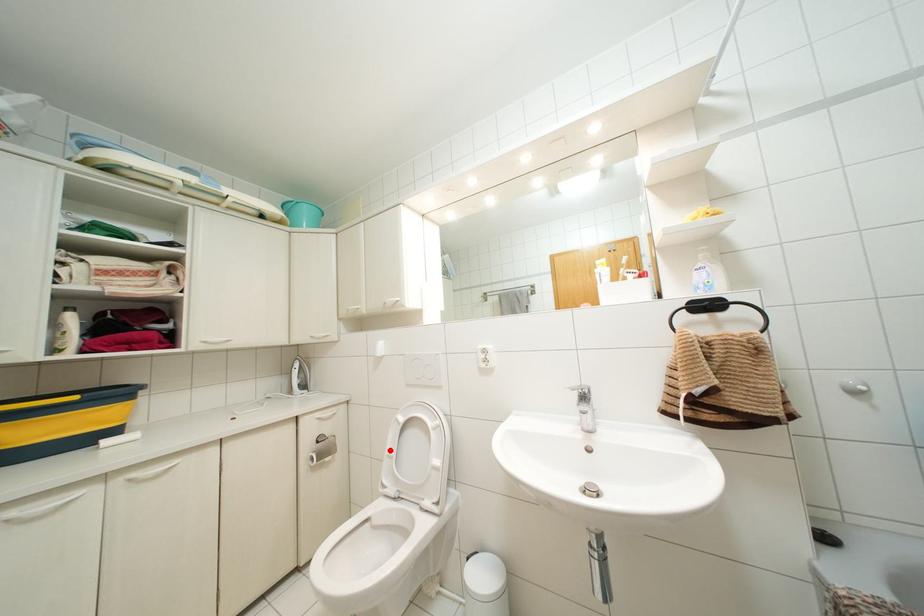
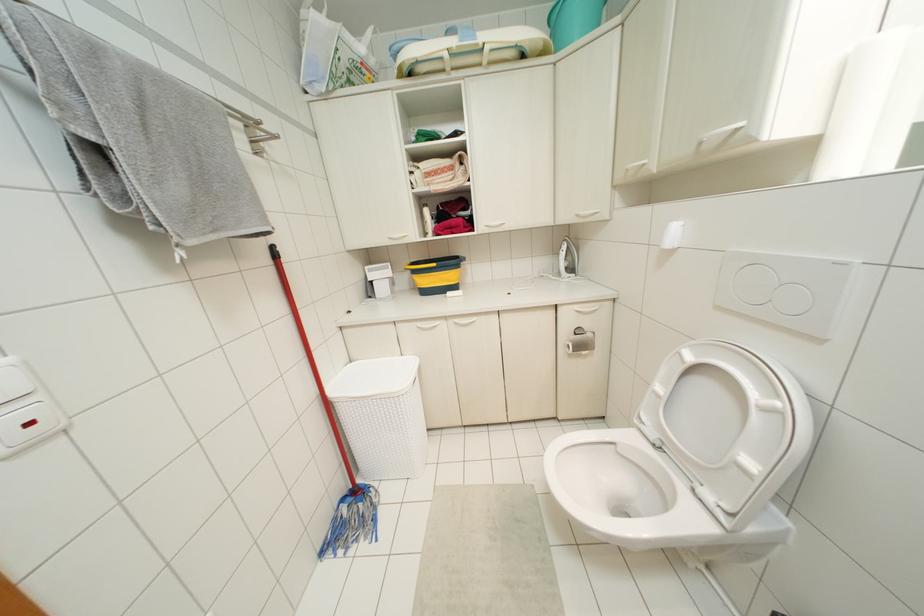
Where in the second image is the point corresponding to the highlighted location from the first image?

(659, 387)